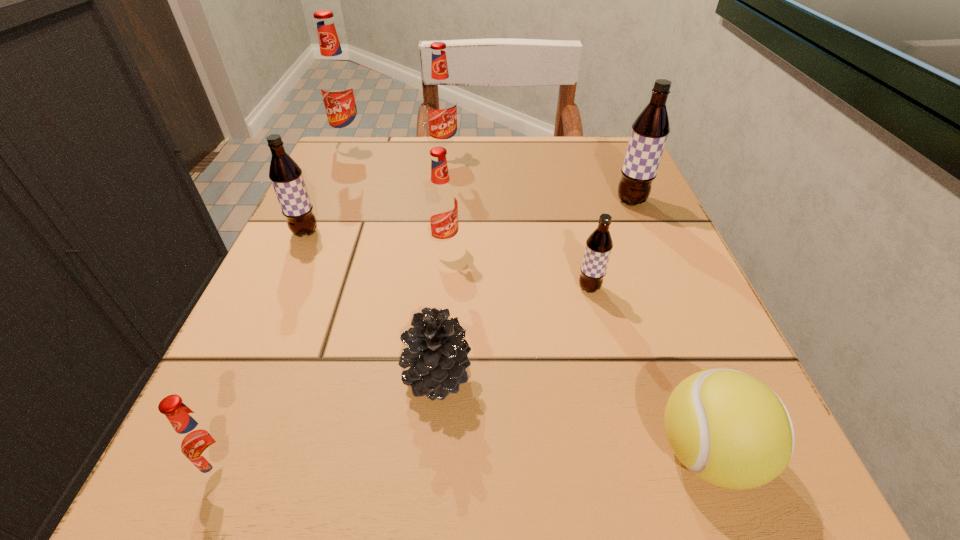
Find the location of a particular element. This screenshot has height=540, width=960. the tallest root beer is located at coordinates (338, 86).

Where is `the biggest red root beer`? Image resolution: width=960 pixels, height=540 pixels. the biggest red root beer is located at coordinates (338, 86).

The image size is (960, 540). What are the coordinates of `the third smallest red root beer` in the screenshot? It's located at (441, 101).

You are a GUI agent. You are given a task and a screenshot of the screen. Output one action in this format:
    pyautogui.click(x=<x>, y=<y>)
    Task: Click on the rightmost brown root beer
    Image resolution: width=960 pixels, height=540 pixels.
    Given the screenshot: What is the action you would take?
    pyautogui.click(x=650, y=130)

The width and height of the screenshot is (960, 540). Find the location of `the seventh nearest object`. the seventh nearest object is located at coordinates click(x=650, y=130).

At what (x,y) coordinates should I click in order to perform the action: click on the second smallest red root beer. Please return your answer as a coordinate pair (x, y). This screenshot has height=540, width=960. Looking at the image, I should click on (442, 206).

You are a GUI agent. You are given a task and a screenshot of the screen. Output one action in this format:
    pyautogui.click(x=<x>, y=<y>)
    Task: Click on the leftmost brown root beer
    
    Given the screenshot: What is the action you would take?
    pyautogui.click(x=286, y=176)

This screenshot has height=540, width=960. In order to click on the second farthest brown root beer in this screenshot , I will do `click(286, 176)`.

The image size is (960, 540). What are the coordinates of `the sixth farthest root beer` in the screenshot? It's located at (599, 244).

Identify the location of the third object from right to left. (599, 244).